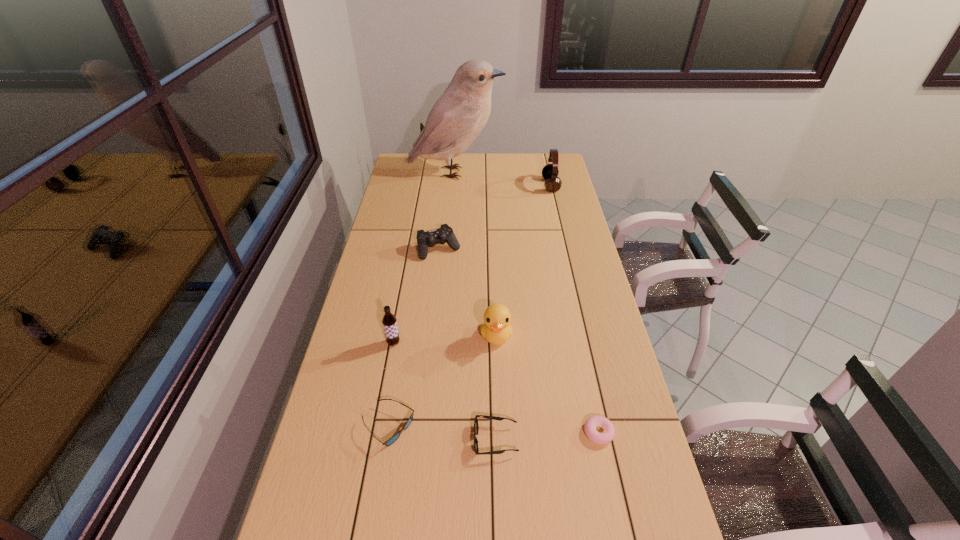
Identify the location of the tallest object. This screenshot has width=960, height=540. (457, 118).

Locate an element on the screen. Image resolution: width=960 pixels, height=540 pixels. headset is located at coordinates [x=550, y=172].

The height and width of the screenshot is (540, 960). Identify the location of root beer. (389, 321).

Where is `the fourth tallest object`? This screenshot has height=540, width=960. the fourth tallest object is located at coordinates (496, 329).

Locate an element on the screen. This screenshot has width=960, height=540. control is located at coordinates (444, 234).

Identify the location of the sixth nearest object. Image resolution: width=960 pixels, height=540 pixels. (444, 234).

I want to click on the left sunglasses, so click(x=389, y=442).

The image size is (960, 540). I want to click on the right sunglasses, so click(x=476, y=426).

Identify the location of the shortest object. (607, 435).

Find the location of a particular element. vacant area located 0.270m on the face of the tallest object is located at coordinates (556, 172).